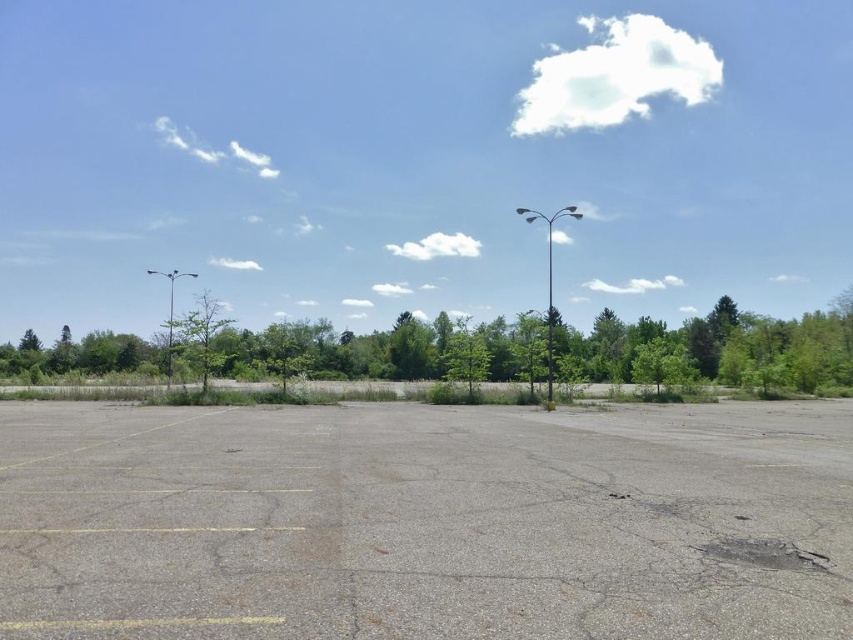
Question: Considering the real-world distances, which object is farthest from the metallic silver pole at center?

Choices:
 (A) metallic pole at left
 (B) metallic pole at center-right
 (C) green leafy tree at center

Answer: (A)

Question: Is gray asphalt parking lot at center in front of metallic pole at left?

Choices:
 (A) no
 (B) yes

Answer: (B)

Question: Considering the real-world distances, which object is farthest from the metallic pole at left?

Choices:
 (A) gray asphalt parking lot at center
 (B) metallic pole at center-right

Answer: (B)

Question: Is metallic pole at center-right wider than metallic silver pole at center?

Choices:
 (A) no
 (B) yes

Answer: (B)

Question: Does metallic pole at center-right come behind metallic silver pole at center?

Choices:
 (A) yes
 (B) no

Answer: (B)

Question: Which of the following is the farthest from the observer?

Choices:
 (A) green leafy tree at center
 (B) metallic pole at left
 (C) metallic silver pole at center

Answer: (B)